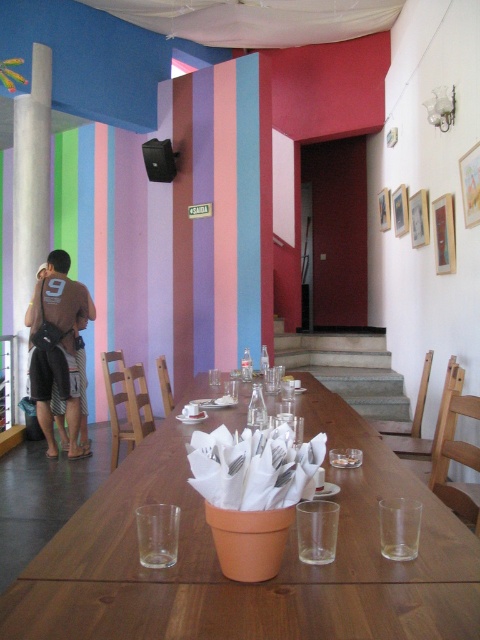
Question: Which point appears farthest from the camera in this image?

Choices:
 (A) (432, 595)
 (B) (38, 316)

Answer: (B)

Question: Is wooden table at center thinner than brown cotton t-shirt at left?

Choices:
 (A) no
 (B) yes

Answer: (A)

Question: Observing the image, what is the correct spatial positioning of wooden table at center in reference to brown cotton t-shirt at left?

Choices:
 (A) above
 (B) below

Answer: (B)

Question: Is wooden table at center smaller than brown cotton t-shirt at left?

Choices:
 (A) no
 (B) yes

Answer: (B)

Question: Which point is closer to the camera taking this photo?

Choices:
 (A) (43, 369)
 (B) (346, 412)

Answer: (B)

Question: Among these objects, which one is farthest from the camera?

Choices:
 (A) wooden table at center
 (B) brown cotton t-shirt at left

Answer: (B)